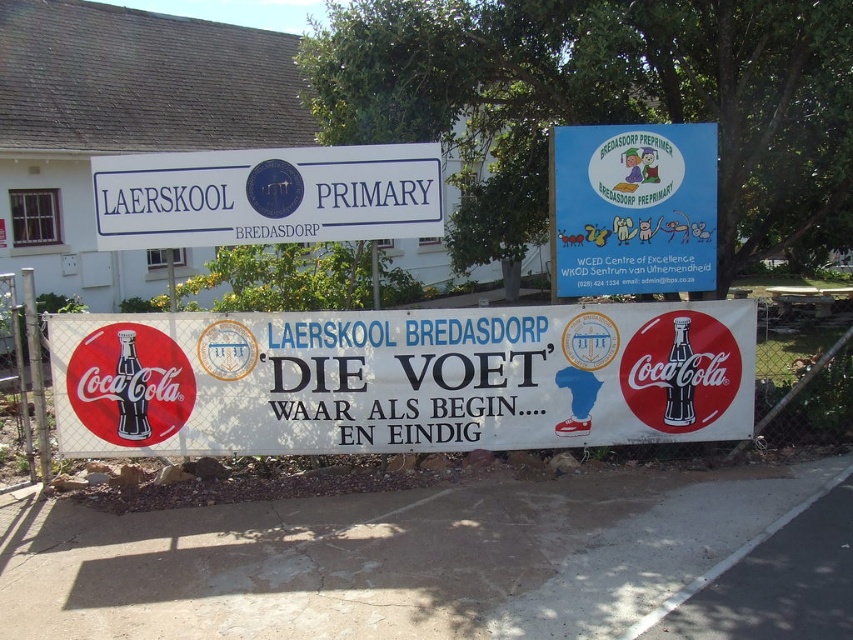
You are standing at the entrance of the school and need to locate the blue paper sign at upper right. According to the coordinates given, where exactly is it positioned?

The blue paper sign at upper right is positioned at coordinates point (633, 209).

You are a visitor approaching the school entrance and want to read both the white plastic banner at center and the blue paper sign at upper right. Which one should you look at first to follow the natural reading order from left to right?

The white plastic banner at center is to the left of the blue paper sign at upper right, so you should look at the white plastic banner at center first to follow the natural left to right reading order.

Consider the image. You are standing at the entrance of the school and see the matte black bottle at center. If you walk straight ahead, will the bottle remain in your line of sight?

The matte black bottle at center is located at point (131, 390), so if you walk straight ahead, the bottle will likely remain in your line of sight as it is centrally positioned.